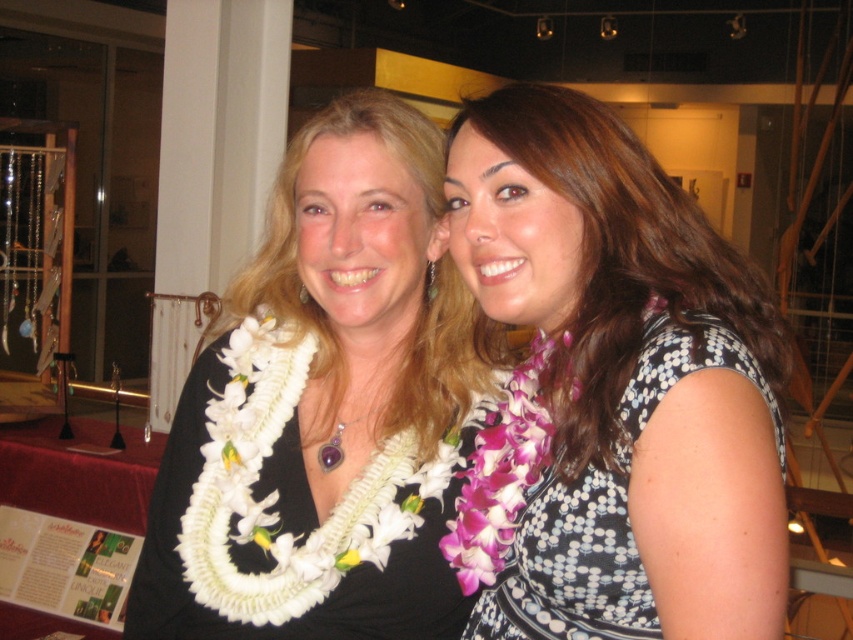
Does purple floral lei at right have a greater width compared to purple gemstone pendant at center?

Yes, purple floral lei at right is wider than purple gemstone pendant at center.

Which is in front, point (543, 154) or point (368, 410)?

Point (543, 154) is more forward.

Measure the distance between point [595,436] and camera.

Point [595,436] is 33.33 inches from camera.

Where is `purple floral lei at right`? The height and width of the screenshot is (640, 853). purple floral lei at right is located at coordinates (621, 260).

Who is higher up, white dotted fabric dress at center or purple gemstone pendant at center?

purple gemstone pendant at center is higher up.

Which is in front, point (612, 621) or point (352, 419)?

Positioned in front is point (612, 621).

Does point (543, 512) come in front of point (328, 452)?

Yes, point (543, 512) is closer to viewer.

Find the location of a particular element. white dotted fabric dress at center is located at coordinates (605, 506).

Is white fabric lei at center to the left of purple flower lei at center from the viewer's perspective?

No, white fabric lei at center is not to the left of purple flower lei at center.

Which is below, white fabric lei at center or purple flower lei at center?

white fabric lei at center

Locate an element on the screen. Image resolution: width=853 pixels, height=640 pixels. white fabric lei at center is located at coordinates (289, 515).